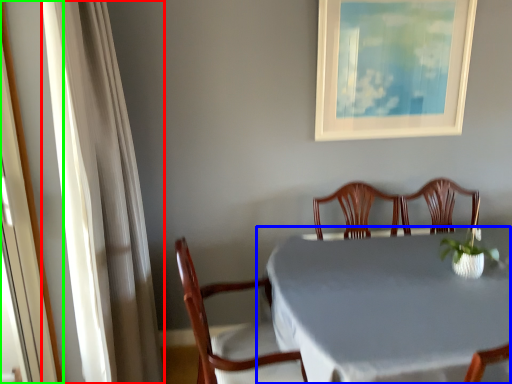
Question: Which object is the closest to the curtain (highlighted by a red box)? Choose among these: table (highlighted by a blue box) or screen door (highlighted by a green box).

Choices:
 (A) table
 (B) screen door

Answer: (B)